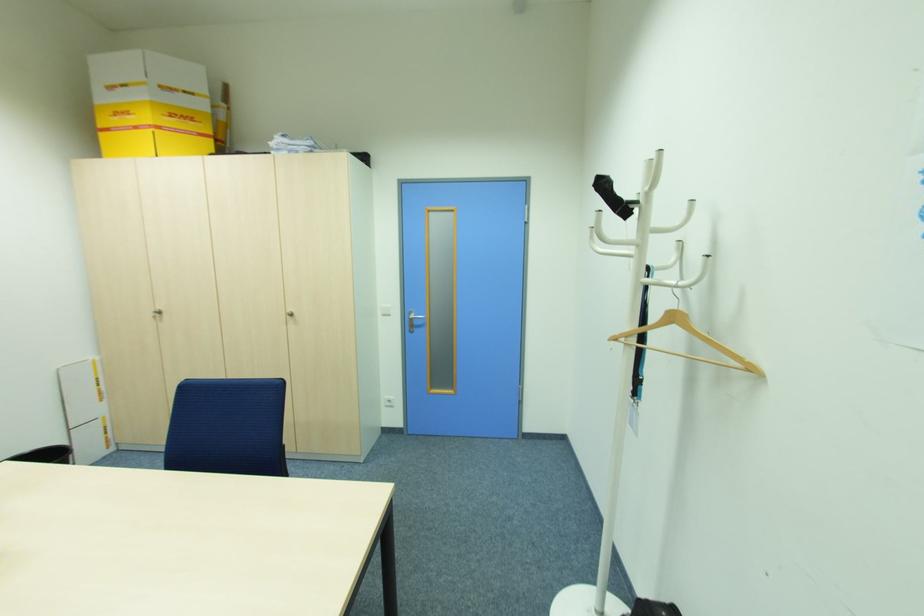
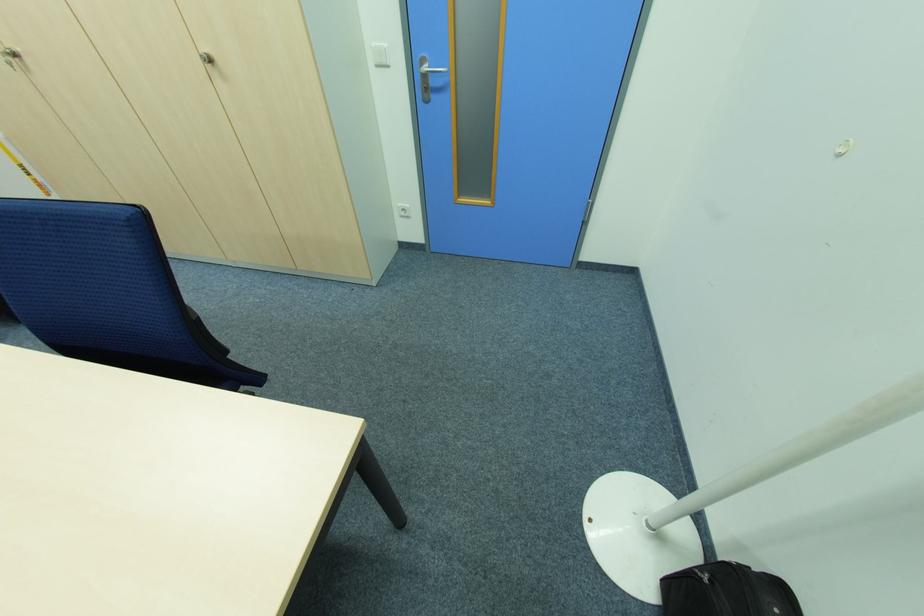
Find the pixel in the second image that matches the point at 392,400 in the first image.

(407, 209)